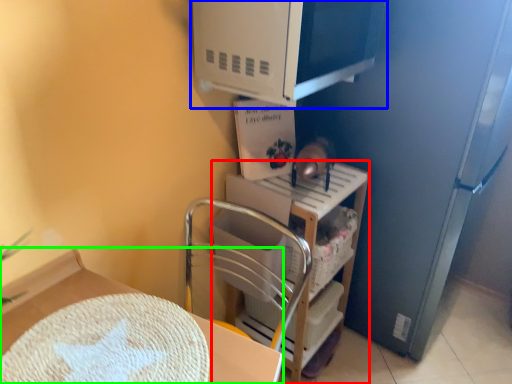
Question: Which object is the closest to the shelf (highlighted by a red box)? Choose among these: appliance (highlighted by a blue box) or furniture (highlighted by a green box).

Choices:
 (A) appliance
 (B) furniture

Answer: (A)